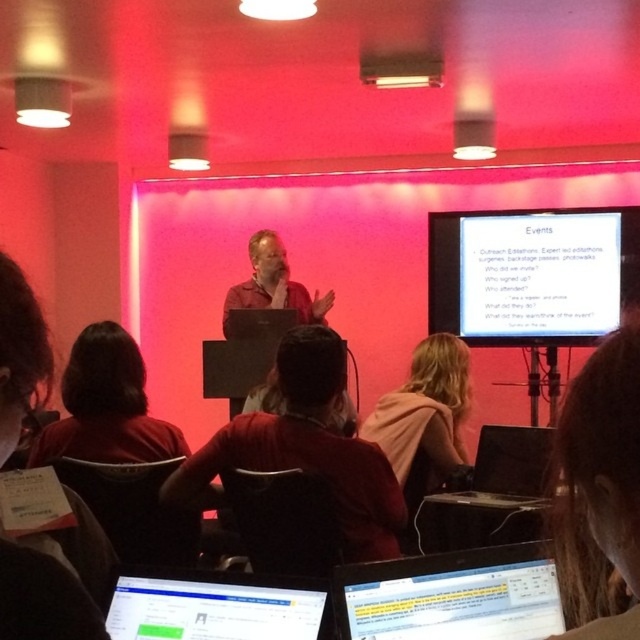
Question: Among these objects, which one is farthest from the camera?

Choices:
 (A) dark brown hair at lower left
 (B) white matte projector screen at upper right
 (C) matte brown shirt at center

Answer: (C)

Question: Which object is the closest to the pink fabric at center?

Choices:
 (A) dark red shirt at lower left
 (B) dark red shirt at center
 (C) matte black laptop at lower center
 (D) matte brown shirt at center

Answer: (B)

Question: Does silver metallic laptop at lower center lie behind dark brown hair at lower left?

Choices:
 (A) yes
 (B) no

Answer: (A)

Question: Can you confirm if matte black laptop at lower center is positioned to the left of dark red shirt at lower left?

Choices:
 (A) no
 (B) yes

Answer: (A)

Question: Estimate the real-world distances between objects in this image. Which object is closer to the dark red shirt at center?

Choices:
 (A) silver metallic laptop at lower center
 (B) matte black laptop at lower center

Answer: (B)

Question: Is blonde hair at upper right thinner than dark brown hair at lower left?

Choices:
 (A) no
 (B) yes

Answer: (A)